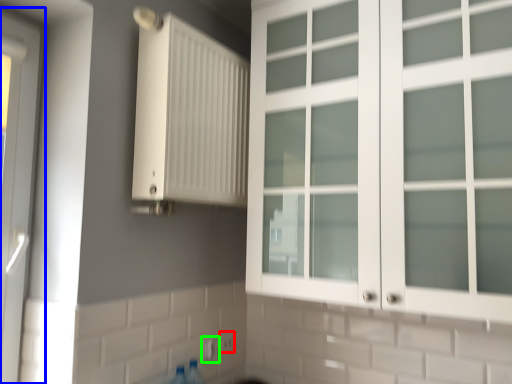
Question: Estimate the real-world distances between objects in this image. Which object is farther from electric outlet (highlighted by a red box), door (highlighted by a blue box) or electric outlet (highlighted by a green box)?

Choices:
 (A) door
 (B) electric outlet

Answer: (A)